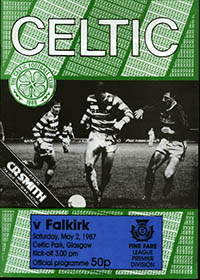
Find the location of a particular element. black and white picture is located at coordinates (132, 148), (61, 174).